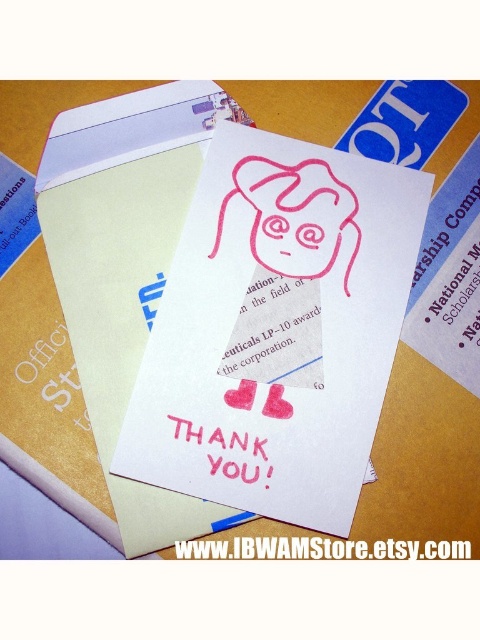
Question: Which point is closer to the camera taking this photo?

Choices:
 (A) (456, 550)
 (B) (394, 189)
 (C) (259, 451)

Answer: (A)

Question: Does pink matte paper at center lie behind pink matte thank you card at center?

Choices:
 (A) yes
 (B) no

Answer: (B)

Question: Observing the image, what is the correct spatial positioning of pink matte paper card at center in reference to pink rubber stamp at center?

Choices:
 (A) below
 (B) above

Answer: (A)

Question: Can you confirm if pink rubber stamp at center is smaller than pink matte thank you card at center?

Choices:
 (A) yes
 (B) no

Answer: (B)

Question: Which of the following is the farthest from the observer?

Choices:
 (A) pink matte paper at center
 (B) pink rubber stamp at center

Answer: (B)

Question: Estimate the real-world distances between objects in this image. Which object is farther from the pink matte thank you card at center?

Choices:
 (A) pink matte paper card at center
 (B) pink matte paper at center
 (C) pink rubber stamp at center

Answer: (C)